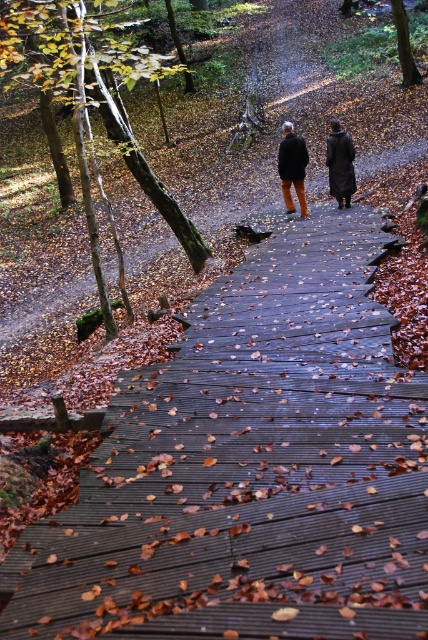
Between point (339, 193) and point (341, 176), which one is positioned in front?

Positioned in front is point (341, 176).

Between point (287, 189) and point (327, 144), which one is positioned behind?

The point (287, 189) is behind.

You are a GUI agent. You are given a task and a screenshot of the screen. Output one action in this format:
    pyautogui.click(x=<x>, y=<y>)
    Task: Click on the dark brown leather coat at center
    
    Given the screenshot: What is the action you would take?
    pyautogui.click(x=339, y=163)

Where is `dark brown leather coat at center`? The height and width of the screenshot is (640, 428). dark brown leather coat at center is located at coordinates (339, 163).

Is dark brown leather coat at center wider than matte black jacket at center?

Yes.

Which is more to the left, dark brown leather coat at center or matte black jacket at center?

matte black jacket at center is more to the left.

Is point (299, 147) in front of point (299, 182)?

That is True.

Where is `dark brown leather coat at center`? The height and width of the screenshot is (640, 428). dark brown leather coat at center is located at coordinates (339, 163).

Consider the image. Can you confirm if matte black jacket at center is positioned above dark brown leather coat at upper right?

Yes.

Is matte black jacket at center wider than dark brown leather coat at upper right?

No, matte black jacket at center is not wider than dark brown leather coat at upper right.

Locate an element on the screen. Image resolution: width=428 pixels, height=640 pixels. matte black jacket at center is located at coordinates (293, 168).